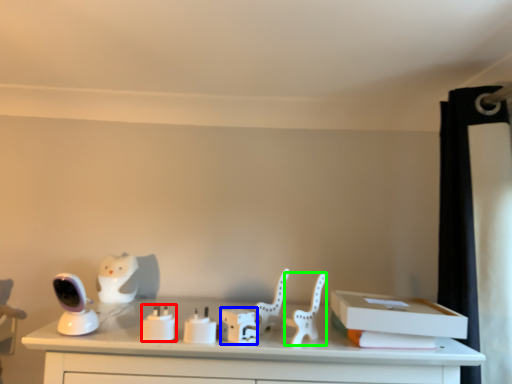
Question: Which object is the farthest from candle holder (highlighted by a red box)? Choose among these: box (highlighted by a blue box) or chair (highlighted by a green box).

Choices:
 (A) box
 (B) chair

Answer: (B)